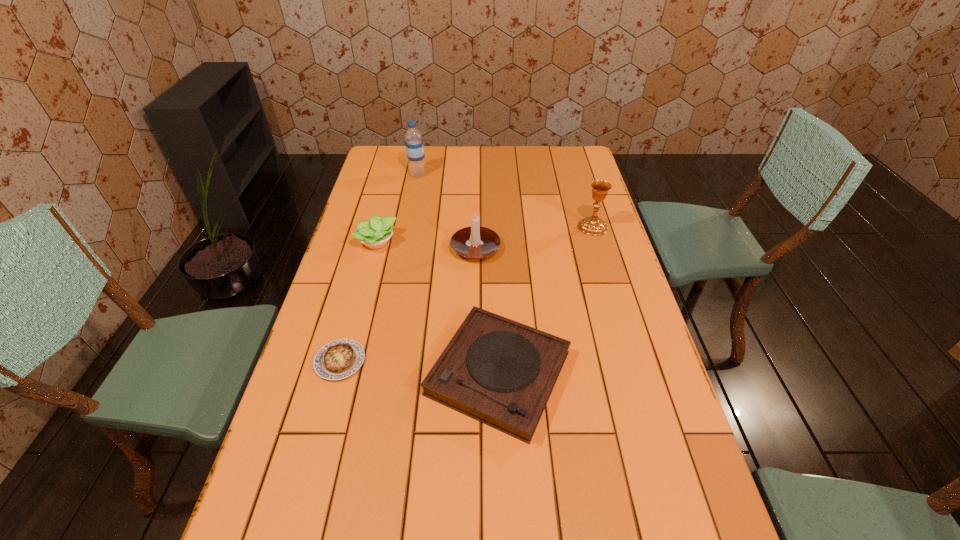
At what (x,y) coordinates should I click in order to perform the action: click on the farthest object. Please return your answer as a coordinate pair (x, y). Image resolution: width=960 pixels, height=540 pixels. Looking at the image, I should click on (413, 138).

Find the location of a particular element. This screenshot has width=960, height=540. the tallest object is located at coordinates (413, 138).

Identify the location of candle. The width and height of the screenshot is (960, 540). (475, 242).

Where is `chalice`? This screenshot has width=960, height=540. chalice is located at coordinates (593, 225).

Where is `the third shortest object`? Image resolution: width=960 pixels, height=540 pixels. the third shortest object is located at coordinates (374, 234).

Locate an element on the screen. The image size is (960, 540). phonograph record is located at coordinates [x=500, y=372].

The image size is (960, 540). In order to click on quiche in this screenshot , I will do pos(338,359).

The height and width of the screenshot is (540, 960). I want to click on free space located 0.390m on the label of the water bottle, so click(521, 174).

Find the location of `vacant area situated on the back of the candle`. vacant area situated on the back of the candle is located at coordinates pos(476,208).

Locate an element on the screen. This screenshot has height=540, width=960. free region located on the back of the chalice is located at coordinates (585, 200).